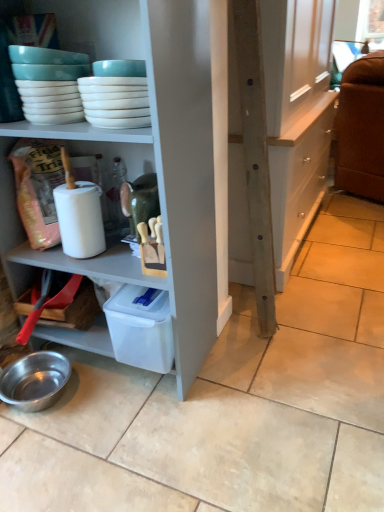
Question: Does white glossy bowls at upper left contain shiny metallic bowl at lower left?

Choices:
 (A) no
 (B) yes

Answer: (A)

Question: From a real-world perspective, is white glossy bowls at upper left physically above shiny metallic bowl at lower left?

Choices:
 (A) no
 (B) yes

Answer: (B)

Question: Are white glossy bowls at upper left and shiny metallic bowl at lower left located far from each other?

Choices:
 (A) yes
 (B) no

Answer: (B)

Question: From the image's perspective, is white glossy bowls at upper left on shiny metallic bowl at lower left?

Choices:
 (A) yes
 (B) no

Answer: (A)

Question: Does white glossy bowls at upper left have a larger size compared to shiny metallic bowl at lower left?

Choices:
 (A) no
 (B) yes

Answer: (A)

Question: In the image, is wooden cabinet at center on the left side or the right side of white glossy bowls at upper left?

Choices:
 (A) right
 (B) left

Answer: (A)

Question: Considering the positions of wooden cabinet at center and white glossy bowls at upper left in the image, is wooden cabinet at center taller or shorter than white glossy bowls at upper left?

Choices:
 (A) tall
 (B) short

Answer: (A)

Question: Is wooden cabinet at center wider or thinner than white glossy bowls at upper left?

Choices:
 (A) thin
 (B) wide

Answer: (B)

Question: From the image's perspective, relative to white glossy bowls at upper left, is wooden cabinet at center above or below?

Choices:
 (A) below
 (B) above

Answer: (B)

Question: Visually, is white glossy bowls at upper left positioned to the left or to the right of shiny metallic bowl at lower left?

Choices:
 (A) right
 (B) left

Answer: (A)

Question: Is white glossy bowls at upper left wider or thinner than shiny metallic bowl at lower left?

Choices:
 (A) wide
 (B) thin

Answer: (B)

Question: From the image's perspective, is white glossy bowls at upper left above or below shiny metallic bowl at lower left?

Choices:
 (A) above
 (B) below

Answer: (A)

Question: Is white glossy bowls at upper left bigger or smaller than shiny metallic bowl at lower left?

Choices:
 (A) small
 (B) big

Answer: (A)

Question: Considering the positions of point (39, 388) and point (279, 208), is point (39, 388) closer or farther from the camera than point (279, 208)?

Choices:
 (A) closer
 (B) farther

Answer: (A)

Question: Would you say shiny metallic bowl at lower left is to the left or to the right of wooden cabinet at center in the picture?

Choices:
 (A) left
 (B) right

Answer: (A)